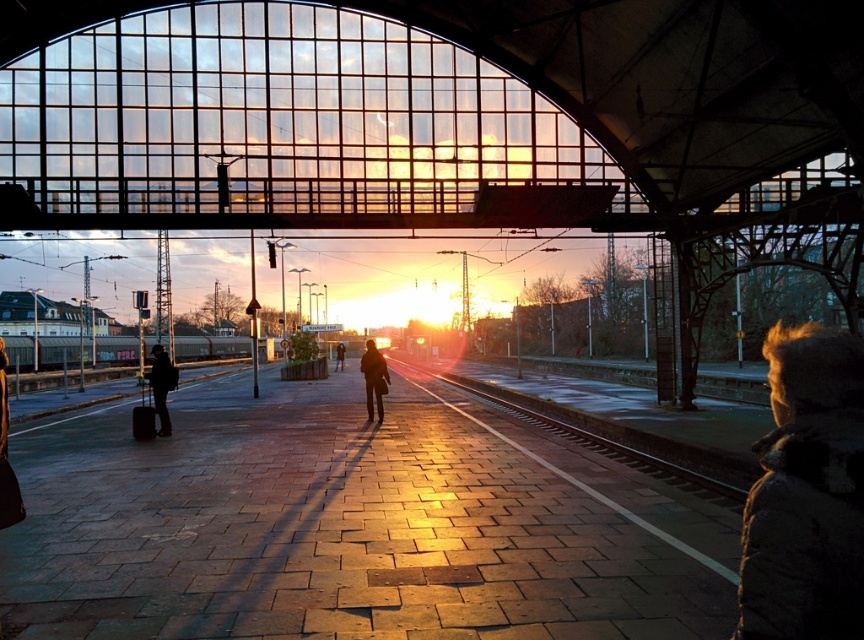
Question: Which of the following is the farthest from the observer?

Choices:
 (A) metallic smooth train track at center
 (B) dark brown leather jacket at center
 (C) matte black suitcase at left
 (D) dark brown leather coat at center

Answer: (B)

Question: Is dark fuzzy jacket at lower right bigger than dark brown leather coat at center?

Choices:
 (A) no
 (B) yes

Answer: (B)

Question: Can you confirm if matte black suitcase at left is positioned to the right of dark brown leather jacket at center?

Choices:
 (A) yes
 (B) no

Answer: (A)

Question: Which of these objects is positioned farthest from the dark brown leather coat at center?

Choices:
 (A) dark fuzzy jacket at lower right
 (B) matte black suitcase at left
 (C) dark brown leather jacket at center
 (D) metallic smooth train track at center

Answer: (C)

Question: Considering the relative positions of metallic smooth train track at center and matte black suitcase at left in the image provided, where is metallic smooth train track at center located with respect to matte black suitcase at left?

Choices:
 (A) right
 (B) left

Answer: (A)

Question: Which of the following is the farthest from the observer?

Choices:
 (A) (162, 376)
 (B) (563, 422)
 (C) (335, 348)

Answer: (C)